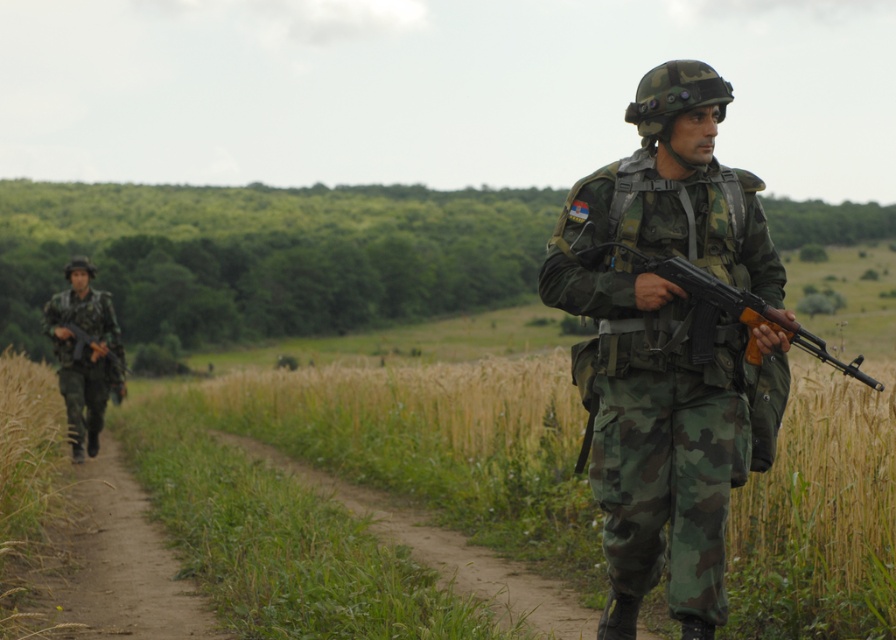
Looking at this image, who is positioned more to the right, camo uniform at center or dirt path at center?

From the viewer's perspective, camo uniform at center appears more on the right side.

Between point (636, 294) and point (171, 577), which one is positioned in front?

Point (636, 294)

Image resolution: width=896 pixels, height=640 pixels. Identify the location of camo uniform at center. (670, 348).

Can you confirm if dirt path at center is positioned above camouflage uniform at left?

Incorrect, dirt path at center is not positioned above camouflage uniform at left.

Between dirt path at center and camouflage uniform at left, which one is positioned lower?

dirt path at center

Does point (65, 592) lie behind point (82, 314)?

No.

Where is `dirt path at center`? dirt path at center is located at coordinates (119, 564).

Does dirt path at center have a lesser height compared to matte black rifle at center?

Incorrect, dirt path at center's height does not fall short of matte black rifle at center's.

Is dirt path at center thinner than matte black rifle at center?

Incorrect, dirt path at center's width is not less than matte black rifle at center's.

Between point (201, 636) and point (823, 339), which one is positioned behind?

The point (823, 339) is behind.

Locate an element on the screen. dirt path at center is located at coordinates (119, 564).